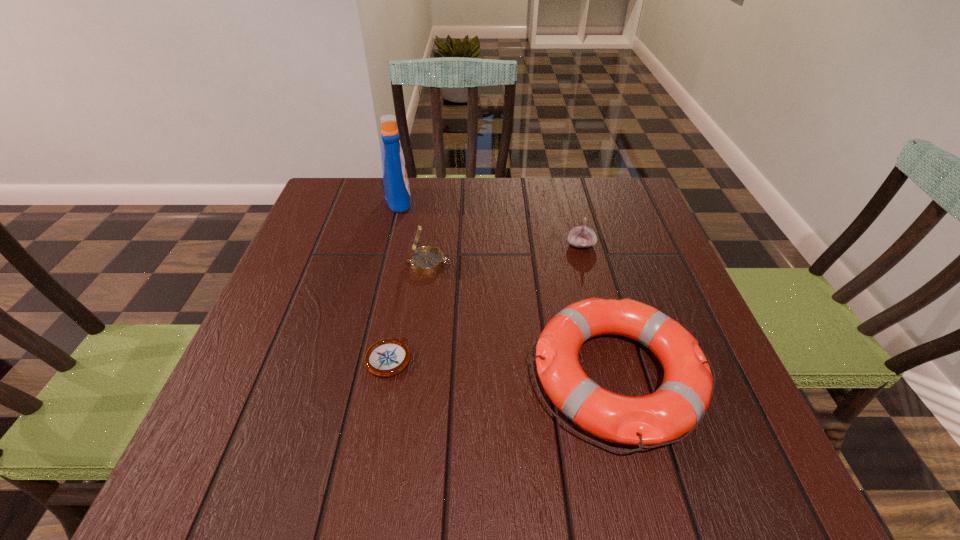
This screenshot has height=540, width=960. I want to click on vacant space at the right edge of the desktop, so click(602, 231).

Find the location of a particular element. The width and height of the screenshot is (960, 540). free point at the far left corner is located at coordinates (331, 226).

Locate an element on the screen. The image size is (960, 540). free spot at the near left corner of the desktop is located at coordinates (263, 473).

Where is `vacant space at the far right corner`? This screenshot has width=960, height=540. vacant space at the far right corner is located at coordinates tap(635, 206).

Identify the location of free space between the shorter compass and the life buoy. (502, 367).

You are a GUI agent. You are given a task and a screenshot of the screen. Output one action in this format:
    pyautogui.click(x=<x>, y=<y>)
    Task: Click on the free space between the farther compass and the life buoy
    
    Given the screenshot: What is the action you would take?
    pyautogui.click(x=522, y=319)

What are the coordinates of `empty space that is in between the second tallest object and the garlic` in the screenshot? It's located at (505, 254).

This screenshot has width=960, height=540. Identify the location of vacant area between the detergent and the life buoy. (507, 288).

What are the coordinates of `vacant point located between the nearer compass and the farther compass` in the screenshot? It's located at (409, 310).

At what (x,y) coordinates should I click in order to perform the action: click on free area in between the shorter compass and the taller compass. Please return your answer as a coordinate pair (x, y). Looking at the image, I should click on [409, 310].